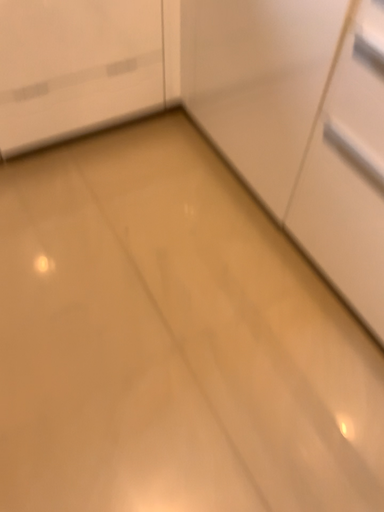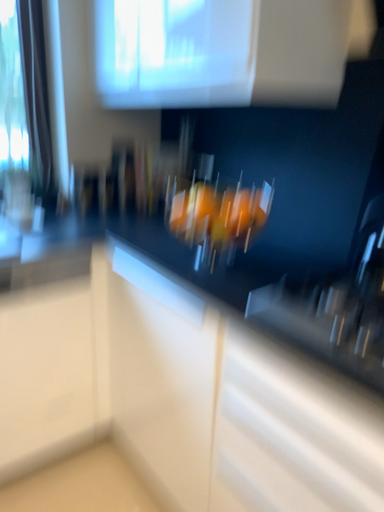
Question: How did the camera likely rotate when shooting the video?

Choices:
 (A) rotated downward
 (B) rotated upward

Answer: (B)